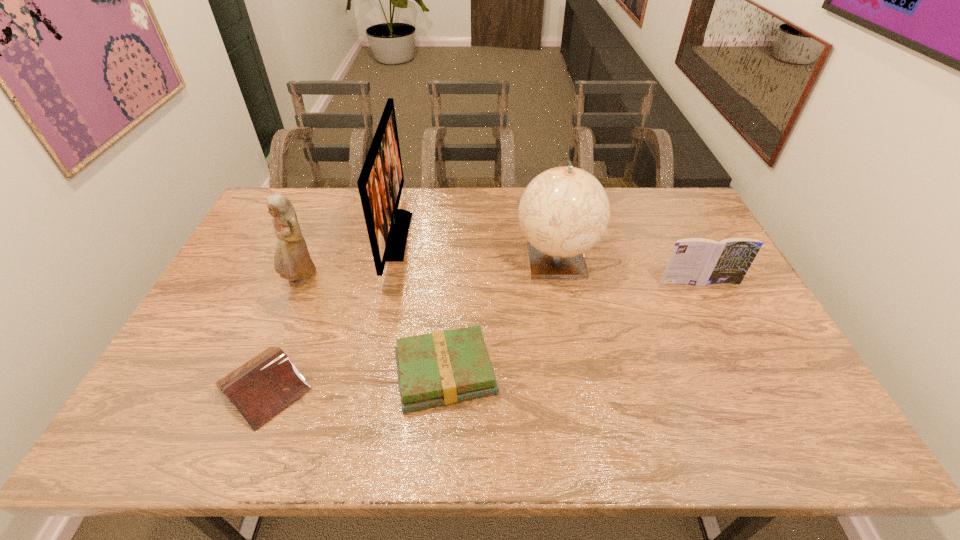
Identify the location of vacant space that satisfies the following two spatial constraints: 1. on the back side of the second book from left to right; 2. on the left side of the leftmost book. Image resolution: width=960 pixels, height=540 pixels. (269, 374).

Locate an element on the screen. vacant space that satisfies the following two spatial constraints: 1. on the front-facing side of the fourth object from right to left; 2. on the left side of the second book from right to left is located at coordinates (364, 374).

The height and width of the screenshot is (540, 960). What are the coordinates of `vacant space that satisfies the following two spatial constraints: 1. on the front-facing side of the third object from right to left; 2. on the left side of the monitor` in the screenshot? It's located at (364, 374).